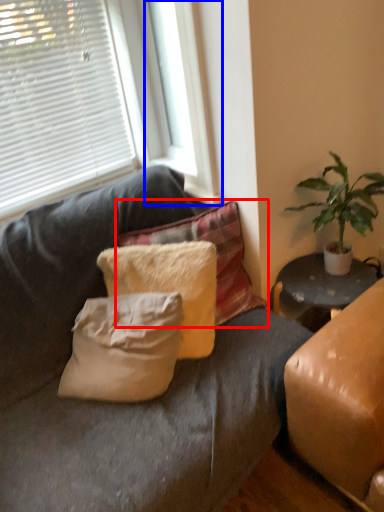
Question: Among these objects, which one is nearest to the camera, pillow (highlighted by a red box) or window frame (highlighted by a blue box)?

Choices:
 (A) pillow
 (B) window frame

Answer: (B)